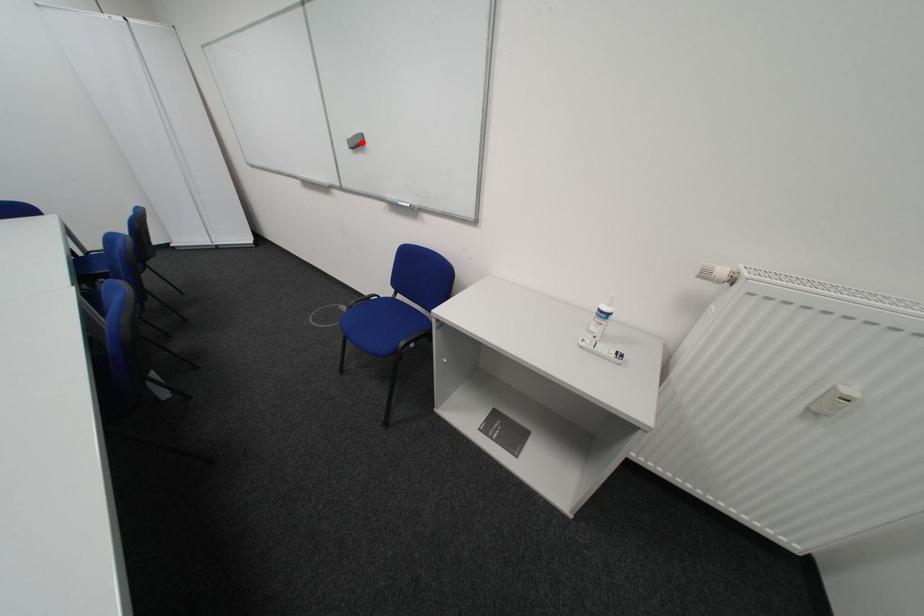
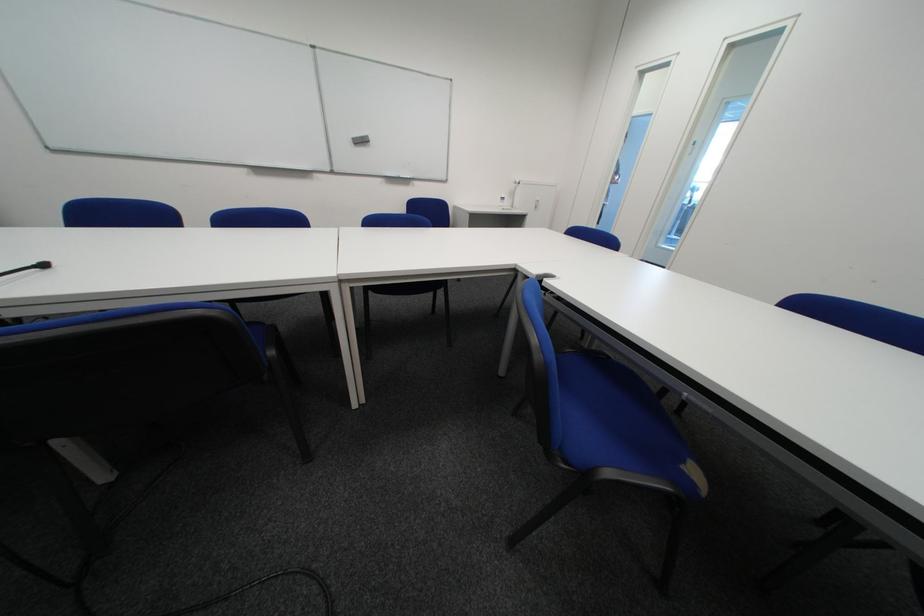
Question: I am providing you with two images of the same scene from different viewpoints. Given a red point in image1, look at the same physical point in image2. Is it:

Choices:
 (A) Closer to the viewpoint
 (B) Farther from the viewpoint

Answer: (A)